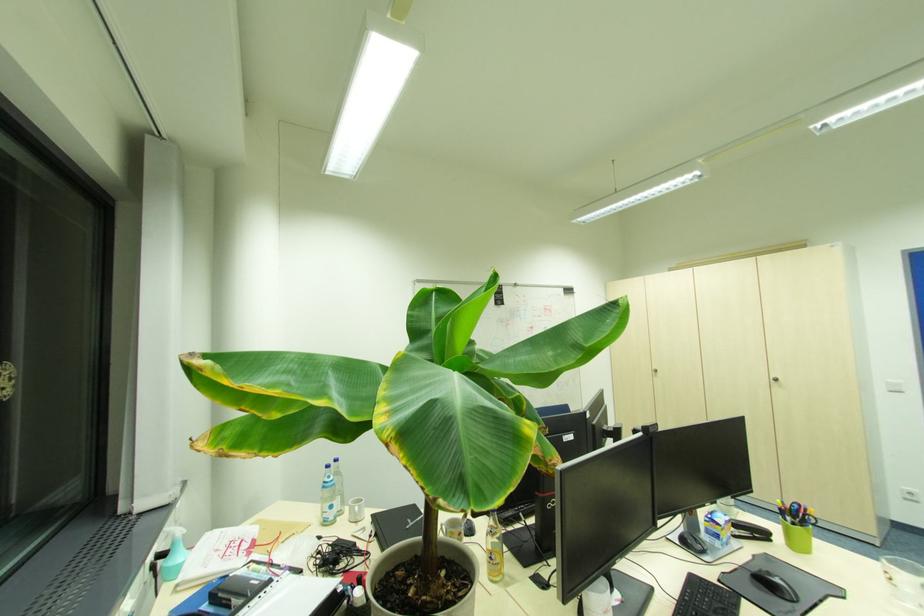
The location [493,548] corresponds to which object?

It refers to a yellow label bottle.